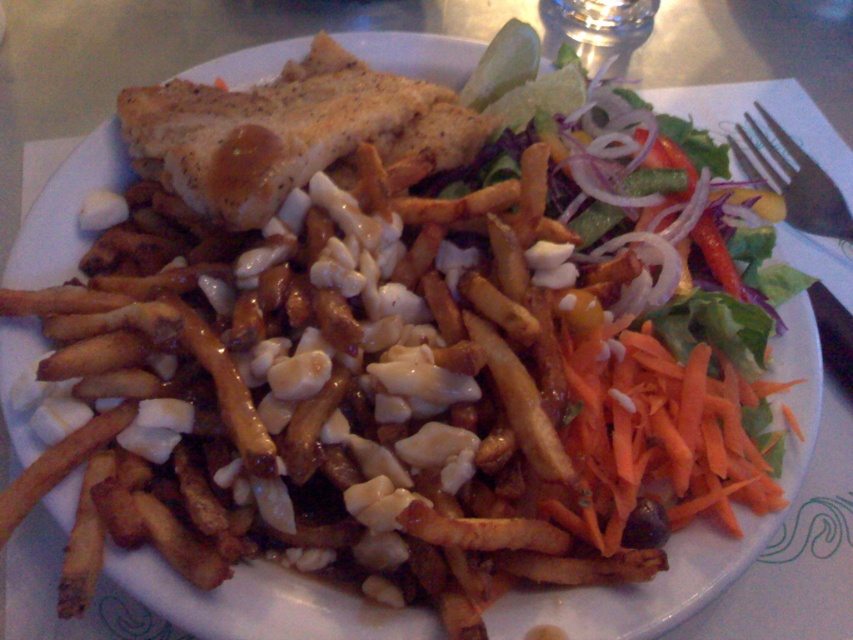
Who is higher up, orange shredded carrot at right or black plastic fork at upper right?

black plastic fork at upper right

Which is below, orange shredded carrot at right or black plastic fork at upper right?

orange shredded carrot at right is lower down.

Locate an element on the screen. The width and height of the screenshot is (853, 640). orange shredded carrot at right is located at coordinates (666, 429).